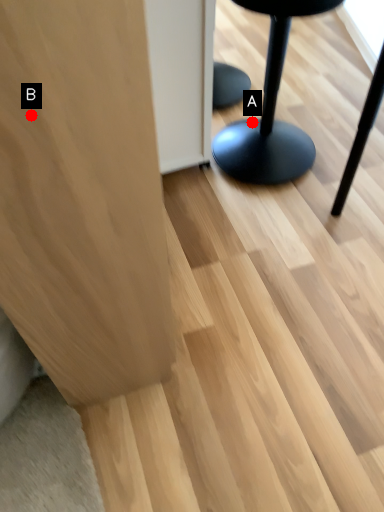
Question: Two points are circled on the image, labeled by A and B beside each circle. Which point is closer to the camera?

Choices:
 (A) A is closer
 (B) B is closer

Answer: (B)